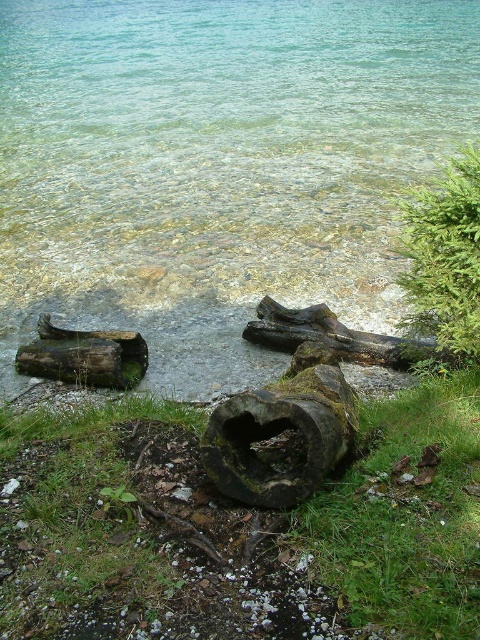
Is green mossy grass at lower center bigger than dark brown wood log at lower left?

Yes.

Does point (355, 529) come behind point (56, 360)?

No.

What do you see at coordinates (407, 513) in the screenshot? I see `green mossy grass at lower center` at bounding box center [407, 513].

Find the location of a particular element. green mossy grass at lower center is located at coordinates (407, 513).

Does point (52, 614) come closer to viewer compared to point (343, 563)?

Yes.

The height and width of the screenshot is (640, 480). Describe the element at coordinates (240, 529) in the screenshot. I see `green mossy log at lower center` at that location.

Which is behind, point (144, 499) or point (428, 416)?

Point (428, 416)

Locate an element on the screen. green mossy log at lower center is located at coordinates (240, 529).

Is green mossy log at lower center to the right of green textured tree at upper right from the viewer's perspective?

No, green mossy log at lower center is not to the right of green textured tree at upper right.

Between green mossy log at lower center and green textured tree at upper right, which one has more height?

Standing taller between the two is green textured tree at upper right.

At what (x,y) coordinates should I click in order to perform the action: click on green mossy log at lower center. Please return your answer as a coordinate pair (x, y). This screenshot has width=480, height=640. Looking at the image, I should click on (240, 529).

The width and height of the screenshot is (480, 640). In order to click on green mossy log at lower center in this screenshot , I will do `click(240, 529)`.